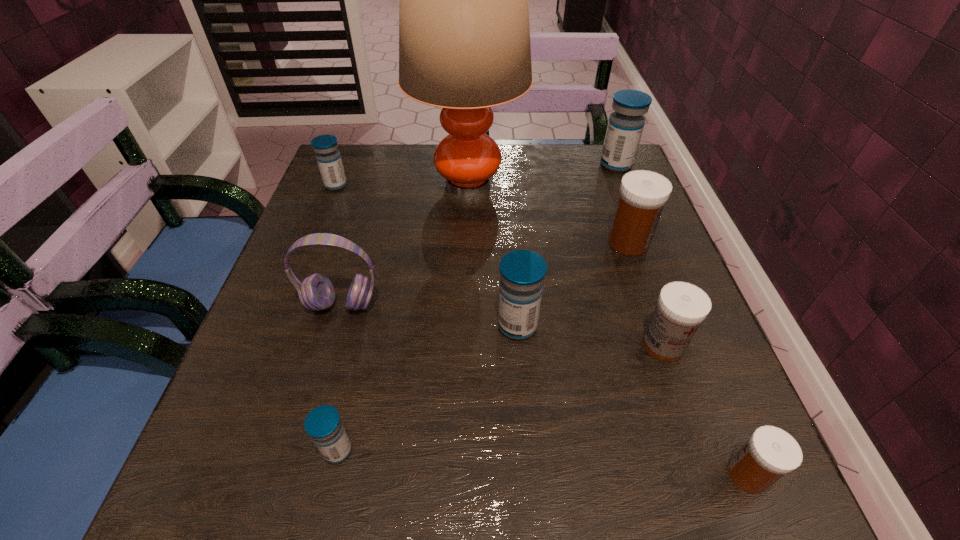
The height and width of the screenshot is (540, 960). Find the location of `empty space that is in between the smallest blue medicine and the second smallest white medicine`. empty space that is in between the smallest blue medicine and the second smallest white medicine is located at coordinates (500, 397).

At what (x,y) coordinates should I click in order to perform the action: click on empty space that is in between the second blue medicine from left to right and the nearest white medicine. Please return your answer as a coordinate pair (x, y). The height and width of the screenshot is (540, 960). Looking at the image, I should click on (542, 462).

Image resolution: width=960 pixels, height=540 pixels. Identify the location of free point between the farthest blue medicine and the second blue medicine from right to left. (566, 245).

You are a GUI agent. You are given a task and a screenshot of the screen. Output one action in this format:
    pyautogui.click(x=<x>, y=<y>)
    Task: Click on the vacant area that lies between the third farthest medicine and the fifth medicine from right to left
    This screenshot has height=540, width=960.
    Given the screenshot: What is the action you would take?
    pyautogui.click(x=573, y=284)

Identify the location of object that can be found as the sixth closest to the third biggest blue medicine. (625, 126).

Choose which object is the seventh nearest neighbor to the fifth medicine from right to left. Please provide its 2D coordinates. Your answer should be formatted as a tuple, i.e. [(x, y)], where the tuple contains the x and y coordinates of a point satisfying the conditions above.

[(625, 126)]

The image size is (960, 540). What are the coordinates of `medicine that is the fifth nearest to the nearest blue medicine` in the screenshot? It's located at (328, 157).

Identify which medicine is the third nearest to the tallest object. Please provide its 2D coordinates. Your answer should be formatted as a tuple, i.e. [(x, y)], where the tuple contains the x and y coordinates of a point satisfying the conditions above.

[(625, 126)]

Find the location of `blue medicine that is the fourth closest to the sixth nearest object`. blue medicine that is the fourth closest to the sixth nearest object is located at coordinates (328, 157).

Choose which blue medicine is the second nearest neighbor to the headset. Please provide its 2D coordinates. Your answer should be formatted as a tuple, i.e. [(x, y)], where the tuple contains the x and y coordinates of a point satisfying the conditions above.

[(323, 424)]